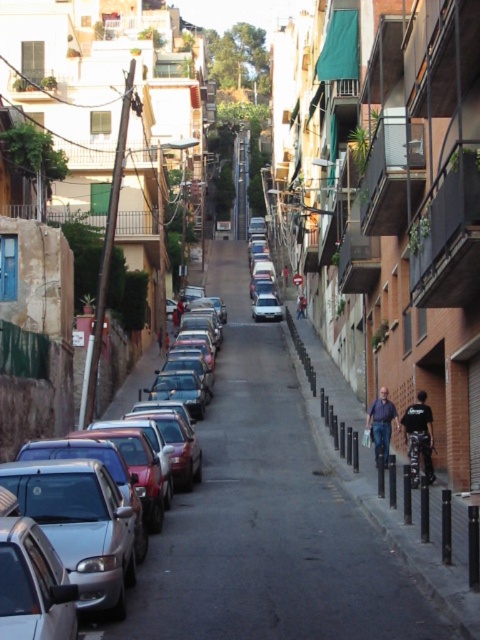
Question: Is shiny silver sedan at left bigger than black leather jacket at lower right?

Choices:
 (A) yes
 (B) no

Answer: (A)

Question: Is silver metallic car at center to the left of black leather jacket at lower right from the viewer's perspective?

Choices:
 (A) no
 (B) yes

Answer: (B)

Question: Which of the following is the farthest from the observer?

Choices:
 (A) (387, 403)
 (B) (271, 268)
 (C) (269, 598)

Answer: (B)

Question: Based on their relative distances, which object is farther from the dark blue jeans at center?

Choices:
 (A) black leather jacket at lower right
 (B) shiny silver sedan at left
 (C) silver metallic car at center

Answer: (A)

Question: Can you confirm if black leather jacket at lower right is bigger than dark blue jeans at center?

Choices:
 (A) yes
 (B) no

Answer: (A)

Question: Among these objects, which one is farthest from the camera?

Choices:
 (A) silver metallic car at center
 (B) dark blue jeans at right
 (C) shiny silver sedan at left

Answer: (A)